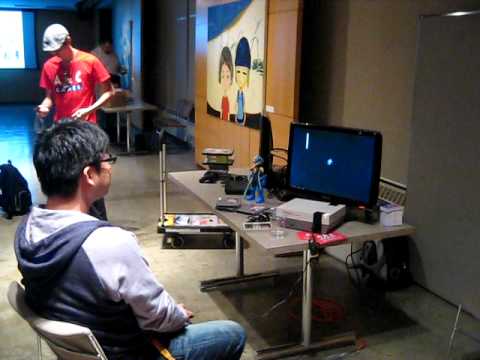
At what (x,y) coordinates should I click in order to perform the action: click on monitor. Please return your answer as a coordinate pair (x, y). This screenshot has width=480, height=360. Looking at the image, I should click on pyautogui.click(x=357, y=162).